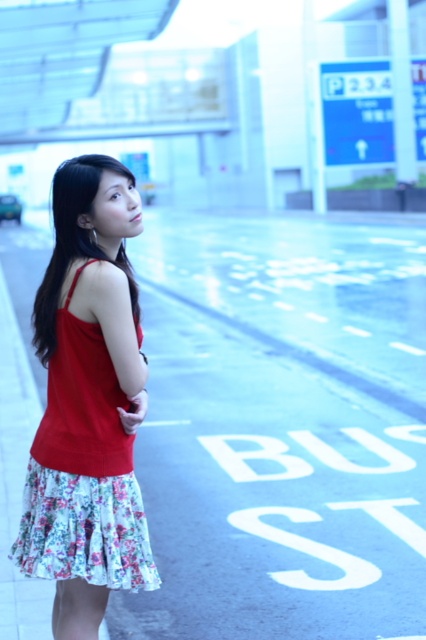
Who is higher up, blue asphalt pavement at center or red floral dress at center?

Positioned higher is blue asphalt pavement at center.

Can you confirm if blue asphalt pavement at center is wider than red floral dress at center?

Yes, blue asphalt pavement at center is wider than red floral dress at center.

Does point (218, 300) come closer to viewer compared to point (100, 484)?

No, (218, 300) is further to viewer.

At what (x,y) coordinates should I click in order to perform the action: click on blue asphalt pavement at center. Please return your answer as a coordinate pair (x, y). This screenshot has height=640, width=426. Looking at the image, I should click on (282, 426).